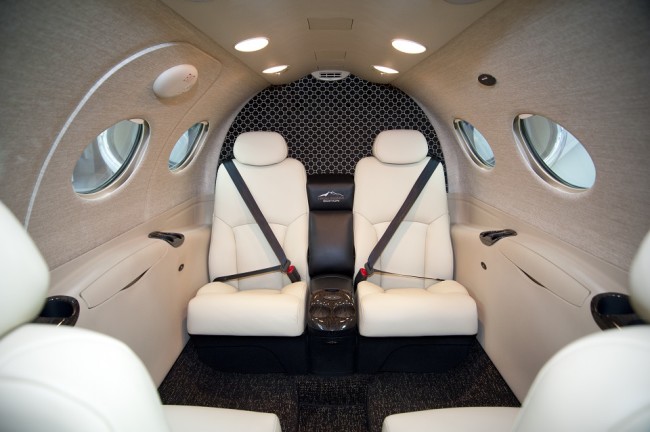
Find the location of a particular element. The width and height of the screenshot is (650, 432). compartment is located at coordinates (130, 275).